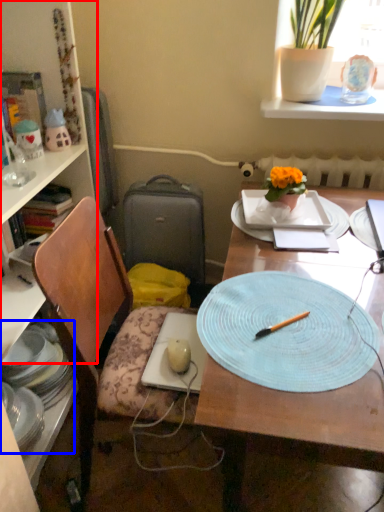
Question: Among these objects, which one is nearest to the camera, bookcase (highlighted by a red box) or tableware (highlighted by a blue box)?

Choices:
 (A) bookcase
 (B) tableware

Answer: (A)